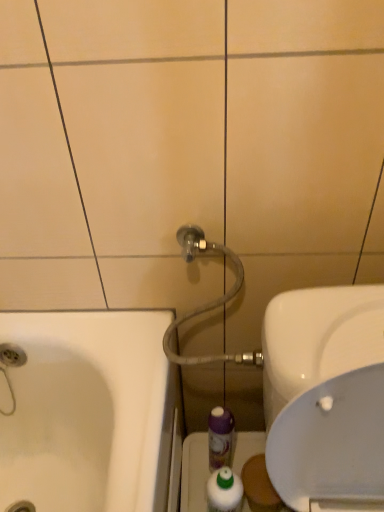
Question: Is purple plastic mouthwash at center, which is the 1th mouthwash from back to front, in front of or behind white glossy mouthwash at lower center, the 1th mouthwash viewed from the front, in the image?

Choices:
 (A) behind
 (B) front

Answer: (A)

Question: In terms of width, does purple plastic mouthwash at center, the 2th mouthwash viewed from the front, look wider or thinner when compared to white glossy mouthwash at lower center, the 1th mouthwash viewed from the front?

Choices:
 (A) wide
 (B) thin

Answer: (B)

Question: Estimate the real-world distances between objects in this image. Which object is closer to the purple plastic mouthwash at center, which is the 1th mouthwash from back to front?

Choices:
 (A) matte gray hose at upper center
 (B) transparent plastic bottle at lower center
 (C) white glossy mouthwash at lower center, the 1th mouthwash viewed from the front
 (D) white glossy sink at right

Answer: (C)

Question: Which of these objects is positioned closest to the transparent plastic bottle at lower center?

Choices:
 (A) white glossy sink at right
 (B) matte gray hose at upper center
 (C) white glossy mouthwash at lower center, the 2th mouthwash positioned from the back
 (D) purple plastic mouthwash at center, the 2th mouthwash viewed from the front

Answer: (D)